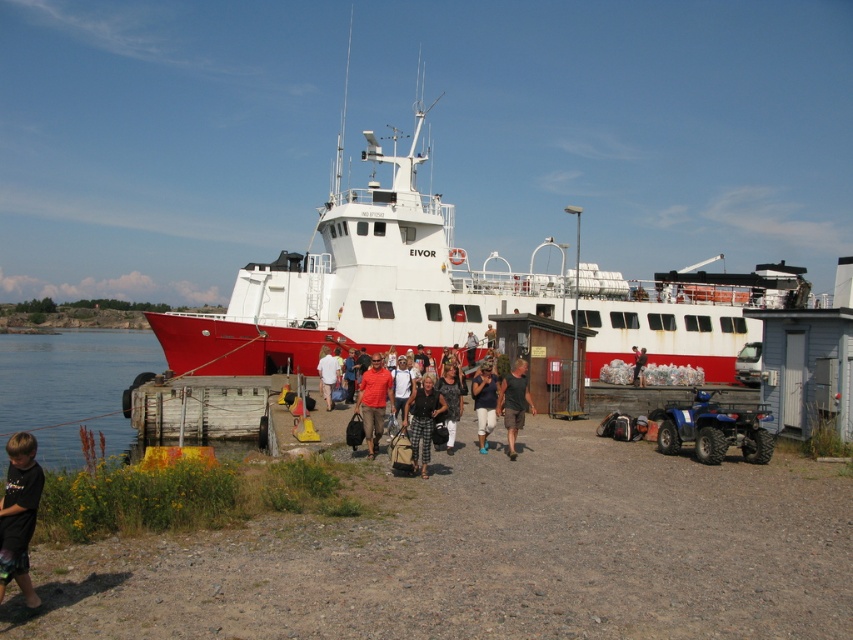
Which is more to the right, dirt ground at center or white cotton shirt at center?

Positioned to the right is dirt ground at center.

Is dirt ground at center further to the viewer compared to white cotton shirt at center?

No, it is in front of white cotton shirt at center.

This screenshot has height=640, width=853. What do you see at coordinates (489, 554) in the screenshot? I see `dirt ground at center` at bounding box center [489, 554].

In order to click on dirt ground at center in this screenshot , I will do click(489, 554).

Who is positioned more to the right, black textured dress at center or white cotton shirt at center?

black textured dress at center

Between black textured dress at center and white cotton shirt at center, which one is positioned higher?

Positioned higher is black textured dress at center.

This screenshot has height=640, width=853. What are the coordinates of `black textured dress at center` in the screenshot? It's located at (450, 401).

Can you confirm if dark brown shorts at lower left is thinner than dark gray fabric shirt at center?

Yes.

From the picture: Between dark brown shorts at lower left and dark gray fabric shirt at center, which one is positioned lower?

dark gray fabric shirt at center is lower down.

I want to click on dark brown shorts at lower left, so click(19, 515).